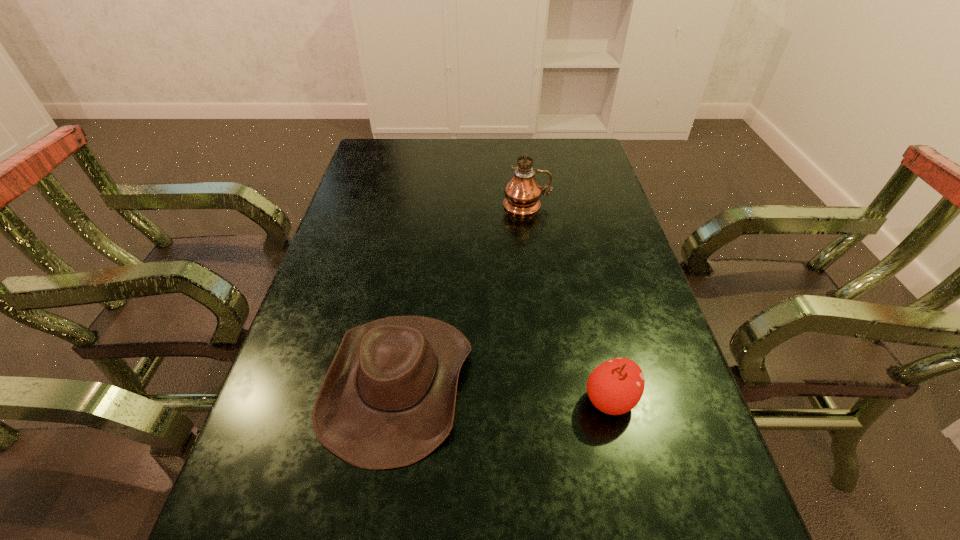
Where is `vacant space at the left edge of the desktop`? The height and width of the screenshot is (540, 960). vacant space at the left edge of the desktop is located at coordinates (308, 317).

Where is `free space at the right edge of the desktop`? The width and height of the screenshot is (960, 540). free space at the right edge of the desktop is located at coordinates (635, 320).

Find the location of a particular element. This screenshot has width=960, height=540. vacant region at the far left corner of the desktop is located at coordinates (383, 145).

You are a GUI agent. You are given a task and a screenshot of the screen. Output one action in this format:
    pyautogui.click(x=<x>, y=<y>)
    Task: Click on the vacant space at the far right corner of the desktop
    
    Given the screenshot: What is the action you would take?
    pyautogui.click(x=560, y=168)

What are the coordinates of `free point between the tallest object and the leftmost object` in the screenshot? It's located at (463, 294).

Where is `unoccupied position between the apple and the farthest object`? The height and width of the screenshot is (540, 960). unoccupied position between the apple and the farthest object is located at coordinates (568, 303).

Identify the location of vacant area between the leftmost object and the tallest object. (463, 294).

The height and width of the screenshot is (540, 960). Identify the location of free spot between the apple and the farthest object. pyautogui.click(x=568, y=303).

This screenshot has height=540, width=960. I want to click on free space that is in between the tallest object and the apple, so (x=568, y=303).

I want to click on object that can be found as the closest to the leftmost object, so click(x=615, y=387).